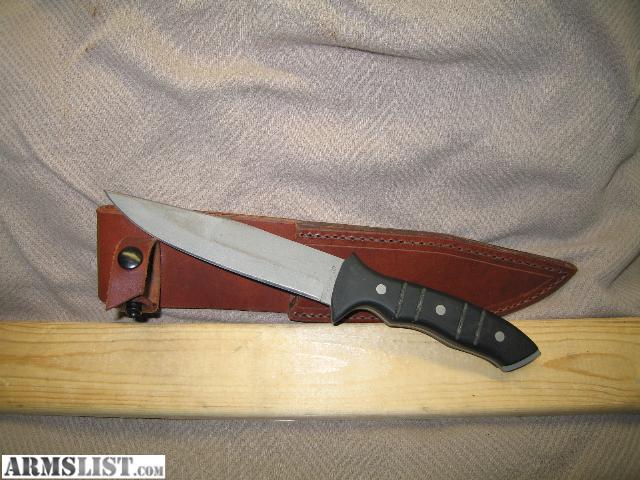
I want to click on wrinkles in blanket, so click(x=383, y=43), click(x=621, y=276), click(x=624, y=158), click(x=43, y=160), click(x=34, y=251), click(x=243, y=74).